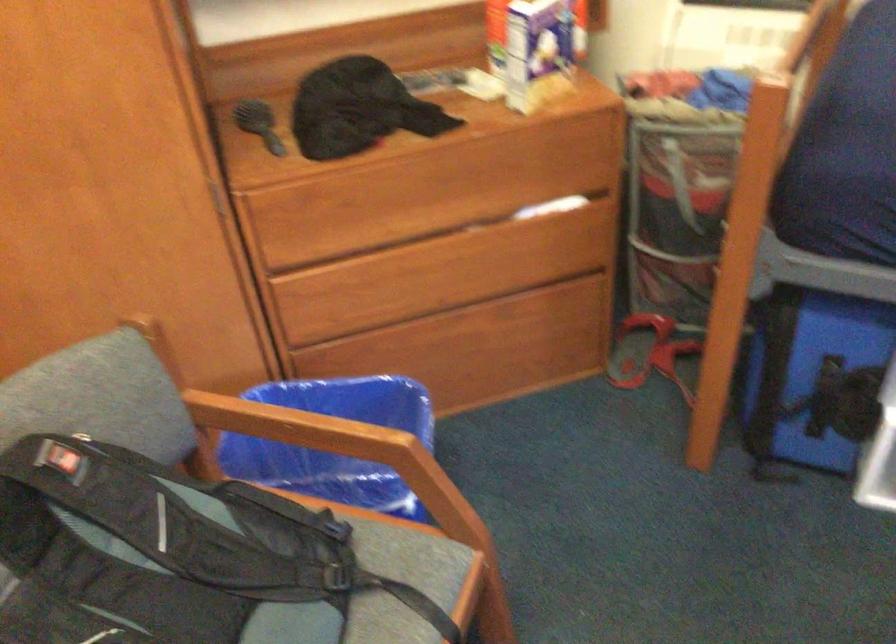
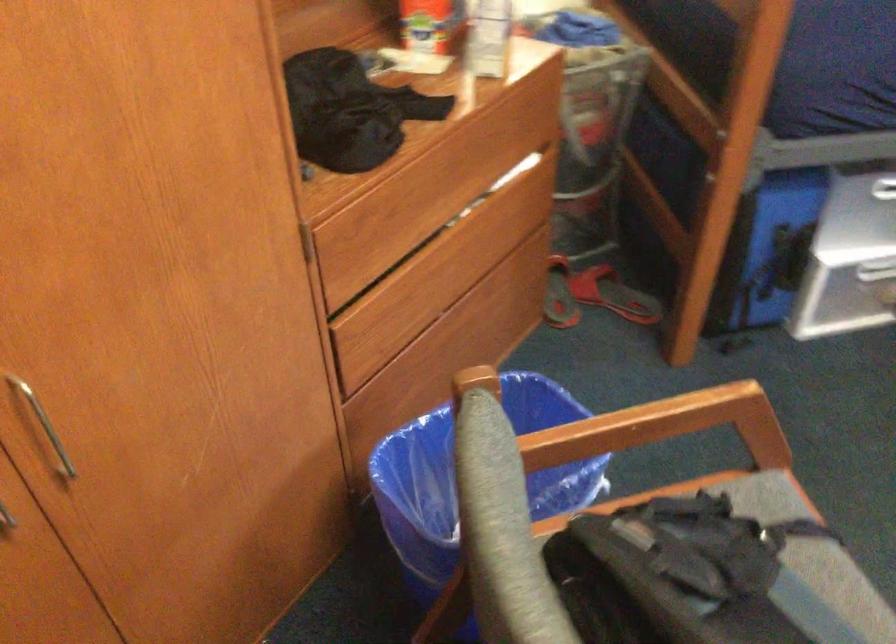
Question: The camera is either moving clockwise (left) or counter-clockwise (right) around the object. The first image is from the beginning of the video and the second image is from the end. Is the camera moving left or right when shooting the video?

Choices:
 (A) Left
 (B) Right

Answer: (A)